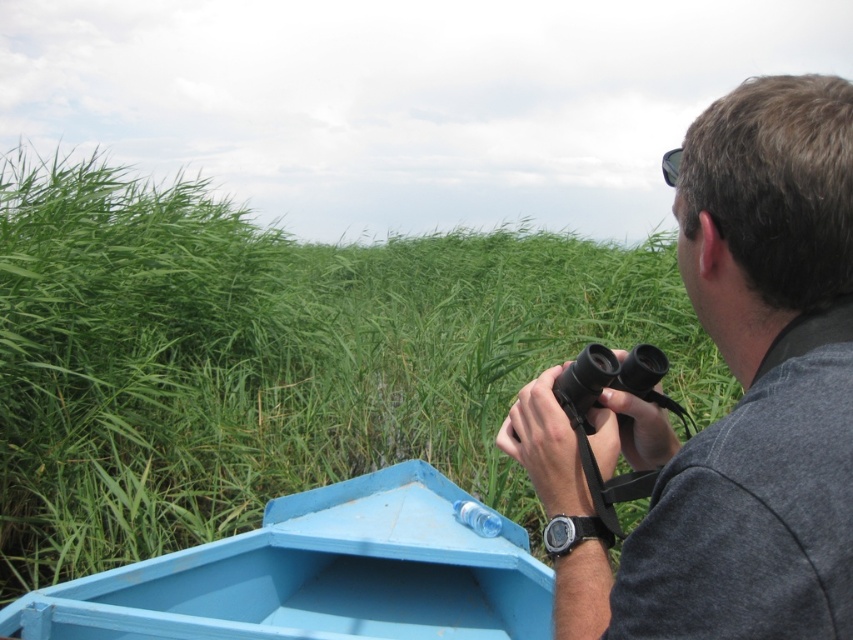
Who is taller, green grass at center or gray fabric shirt at upper right?

Standing taller between the two is green grass at center.

The width and height of the screenshot is (853, 640). What do you see at coordinates (274, 358) in the screenshot? I see `green grass at center` at bounding box center [274, 358].

The width and height of the screenshot is (853, 640). Identify the location of green grass at center. (x=274, y=358).

Which of these two, gray fabric shirt at upper right or light blue painted wood boat at lower left, stands shorter?

With less height is light blue painted wood boat at lower left.

Does gray fabric shirt at upper right appear over light blue painted wood boat at lower left?

Yes, gray fabric shirt at upper right is above light blue painted wood boat at lower left.

Locate an element on the screen. Image resolution: width=853 pixels, height=640 pixels. gray fabric shirt at upper right is located at coordinates (746, 392).

Locate an element on the screen. The height and width of the screenshot is (640, 853). gray fabric shirt at upper right is located at coordinates (746, 392).

Can you confirm if green grass at center is shorter than light blue painted wood boat at lower left?

No, green grass at center is not shorter than light blue painted wood boat at lower left.

Is green grass at center positioned before light blue painted wood boat at lower left?

That is False.

Between point (515, 275) and point (334, 572), which one is positioned behind?

The point (515, 275) is more distant.

Where is `green grass at center`? green grass at center is located at coordinates (274, 358).